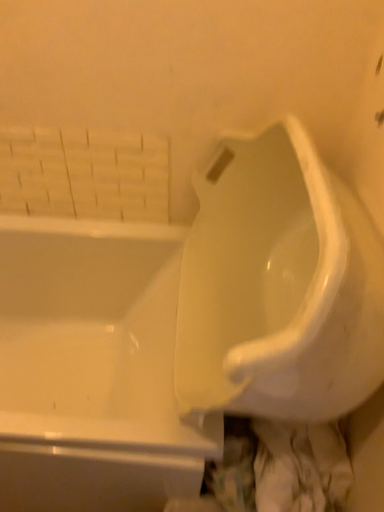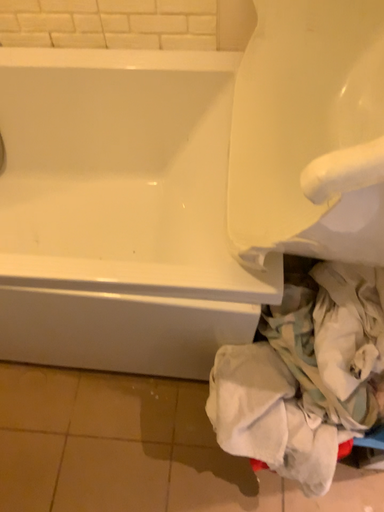
Question: Which way did the camera rotate in the video?

Choices:
 (A) rotated downward
 (B) rotated upward

Answer: (A)